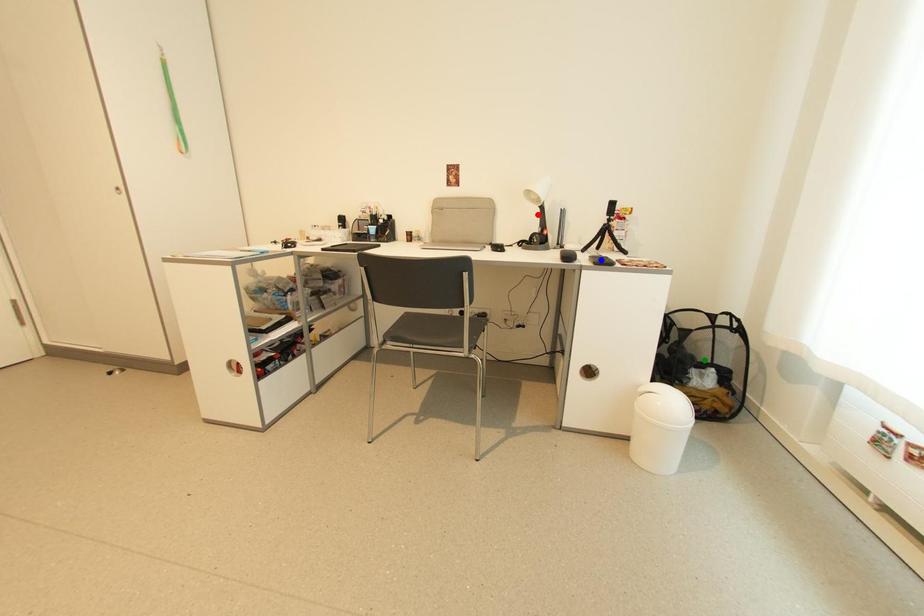
Order these from farthest to nearest:
- blue point
- red point
- green point

1. red point
2. green point
3. blue point